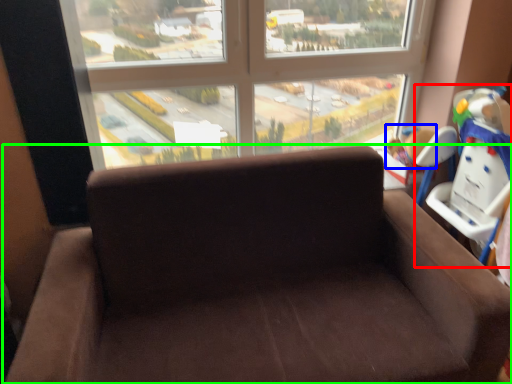
Question: Estimate the real-world distances between objects in this image. Which object is closer to baby carriage (highlighted by a red box), child (highlighted by a blue box) or studio couch (highlighted by a green box)?

Choices:
 (A) child
 (B) studio couch

Answer: (A)